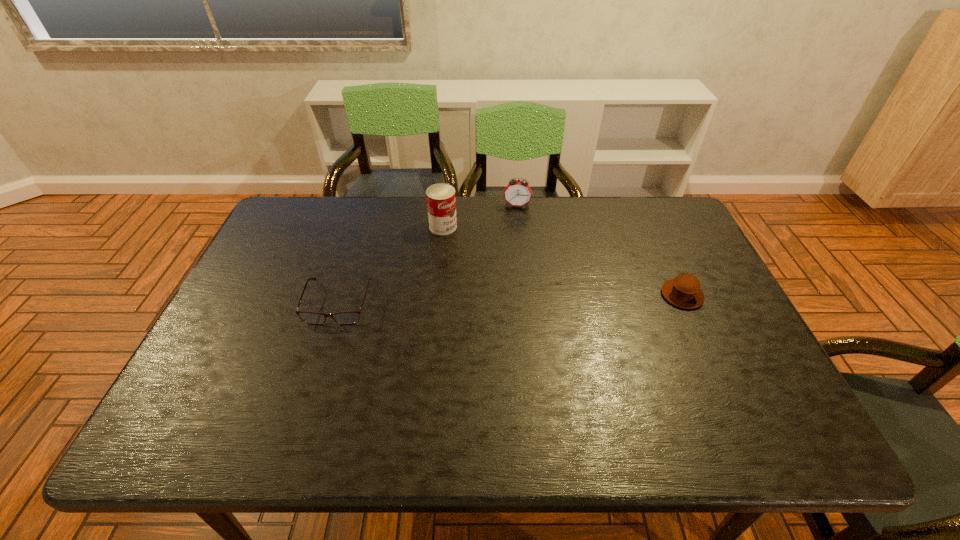
Identify the location of spectacles. This screenshot has width=960, height=540. (350, 317).

The height and width of the screenshot is (540, 960). In order to click on the shortest object in this screenshot , I will do `click(350, 317)`.

This screenshot has width=960, height=540. Identify the location of the rightmost object. (683, 291).

This screenshot has width=960, height=540. Identify the location of muffin. (683, 291).

This screenshot has height=540, width=960. I want to click on the farthest object, so click(518, 193).

The image size is (960, 540). I want to click on alarm clock, so click(x=518, y=193).

You are a GUI agent. You are given a task and a screenshot of the screen. Output one action in this format:
    pyautogui.click(x=<x>, y=<y>)
    Task: Click on the third nearest object
    This screenshot has height=540, width=960.
    Given the screenshot: What is the action you would take?
    [441, 201]

I want to click on the third object from right to left, so (441, 201).

At what (x,y) coordinates should I click in order to perform the action: click on blank area located 0.070m on the lenses of the shortest object. Please return your answer as a coordinate pair (x, y). The image size is (960, 540). Looking at the image, I should click on (324, 347).

Find the location of a particular element. free region located 0.270m on the back of the rightmost object is located at coordinates (649, 222).